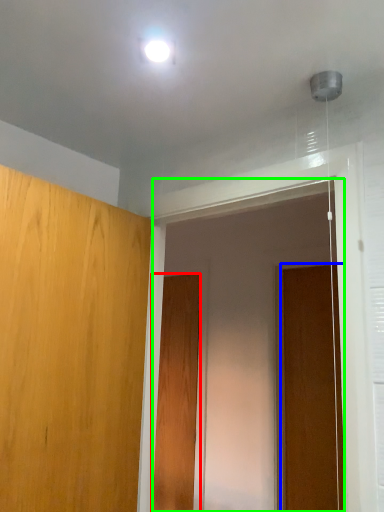
Question: Estimate the real-world distances between objects in this image. Which object is closer to door (highlighted by a red box), door (highlighted by a blue box) or screen door (highlighted by a green box)?

Choices:
 (A) door
 (B) screen door

Answer: (B)